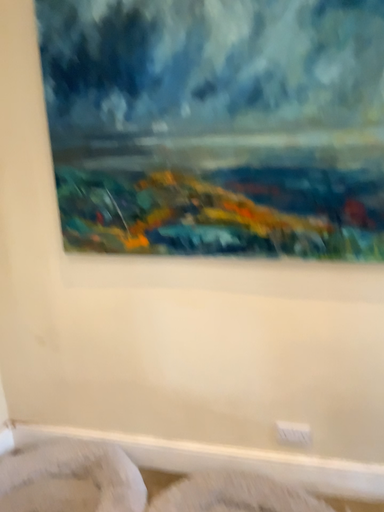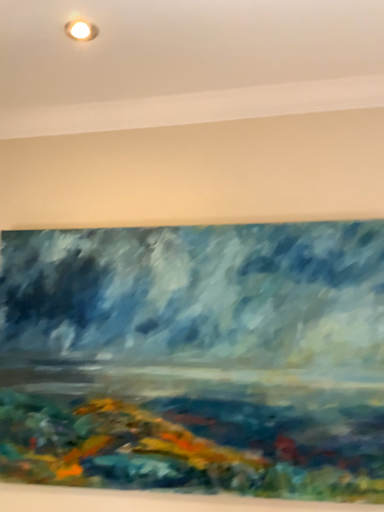
Question: Which way did the camera rotate in the video?

Choices:
 (A) rotated left
 (B) rotated right

Answer: (B)